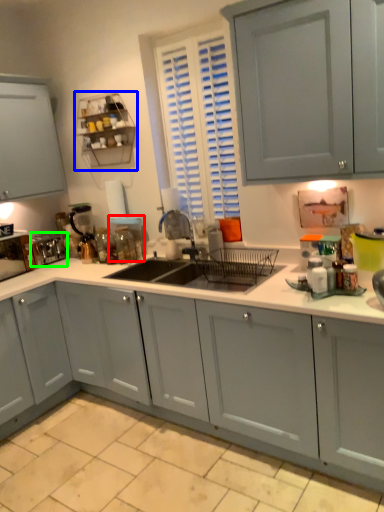
Question: Estimate the real-world distances between objects in this image. Which object is farther from appliance (highlighted by a red box), shelf (highlighted by a blue box) or appliance (highlighted by a green box)?

Choices:
 (A) shelf
 (B) appliance

Answer: (B)